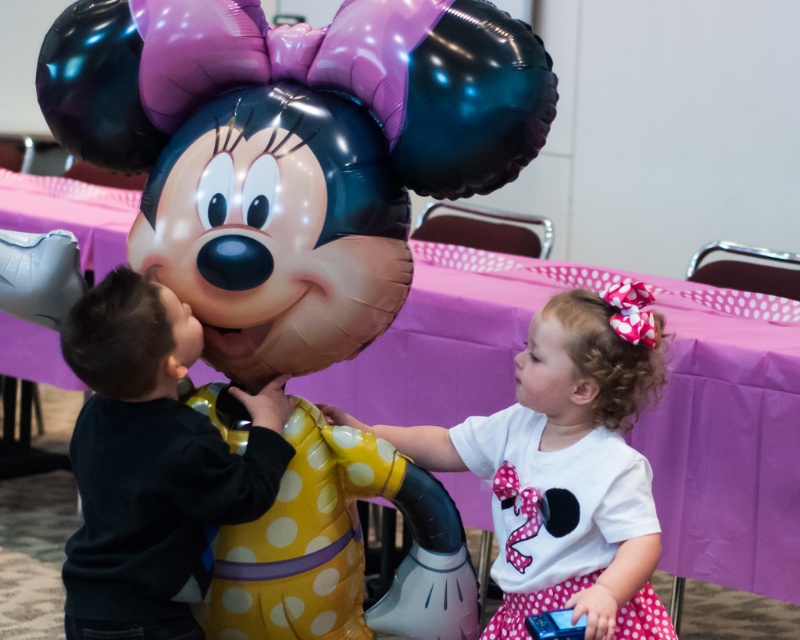
Question: Estimate the real-world distances between objects in this image. Which object is farther from the black matte shirt at left?

Choices:
 (A) white matte shirt at center
 (B) glossy metallic balloon at upper center

Answer: (B)

Question: In this image, where is glossy metallic balloon at upper center located relative to black matte shirt at left?

Choices:
 (A) below
 (B) above

Answer: (B)

Question: Among these objects, which one is nearest to the camera?

Choices:
 (A) black matte shirt at left
 (B) glossy metallic balloon at upper center

Answer: (A)

Question: Which of the following is the closest to the observer?

Choices:
 (A) black matte shirt at left
 (B) white matte shirt at center
 (C) glossy metallic balloon at upper center

Answer: (A)

Question: Is black matte shirt at left below white matte shirt at center?

Choices:
 (A) no
 (B) yes

Answer: (A)

Question: Does black matte shirt at left have a greater width compared to white matte shirt at center?

Choices:
 (A) no
 (B) yes

Answer: (A)